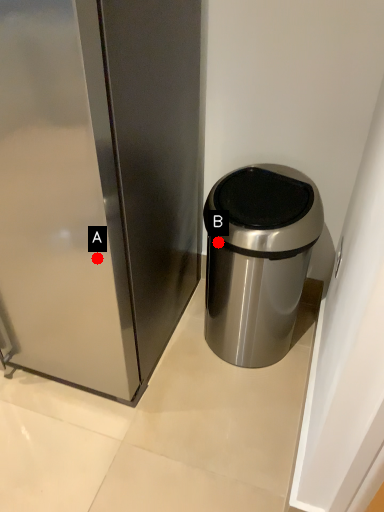
Question: Two points are circled on the image, labeled by A and B beside each circle. Which point is closer to the camera?

Choices:
 (A) A is closer
 (B) B is closer

Answer: (A)